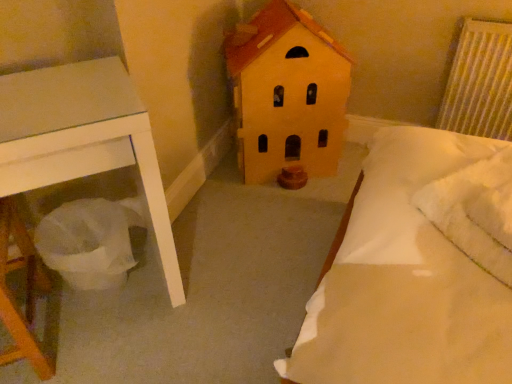
Question: Is matte yellow house at center positioned before white fluffy pillow at upper right?

Choices:
 (A) no
 (B) yes

Answer: (A)

Question: From a real-world perspective, is matte yellow house at center located beneath white fluffy pillow at upper right?

Choices:
 (A) no
 (B) yes

Answer: (B)

Question: Is matte yellow house at center not inside white fluffy pillow at upper right?

Choices:
 (A) yes
 (B) no

Answer: (A)

Question: Is white fluffy pillow at upper right at the back of matte yellow house at center?

Choices:
 (A) no
 (B) yes

Answer: (A)

Question: Is matte yellow house at center positioned behind white fluffy pillow at upper right?

Choices:
 (A) yes
 (B) no

Answer: (A)

Question: Can you confirm if matte yellow house at center is taller than white fluffy pillow at upper right?

Choices:
 (A) no
 (B) yes

Answer: (B)

Question: Is matte yellow house at center not within white textured radiator at upper right?

Choices:
 (A) no
 (B) yes

Answer: (B)

Question: Can you confirm if matte yellow house at center is wider than white textured radiator at upper right?

Choices:
 (A) yes
 (B) no

Answer: (A)

Question: Is matte yellow house at center in front of white textured radiator at upper right?

Choices:
 (A) no
 (B) yes

Answer: (B)

Question: From the image's perspective, is matte yellow house at center above white textured radiator at upper right?

Choices:
 (A) yes
 (B) no

Answer: (B)

Question: Considering the relative positions of matte yellow house at center and white textured radiator at upper right in the image provided, is matte yellow house at center behind white textured radiator at upper right?

Choices:
 (A) yes
 (B) no

Answer: (B)

Question: Can you confirm if matte yellow house at center is shorter than white textured radiator at upper right?

Choices:
 (A) no
 (B) yes

Answer: (A)

Question: Considering the relative sizes of white textured radiator at upper right and white fluffy pillow at upper right in the image provided, is white textured radiator at upper right bigger than white fluffy pillow at upper right?

Choices:
 (A) no
 (B) yes

Answer: (B)